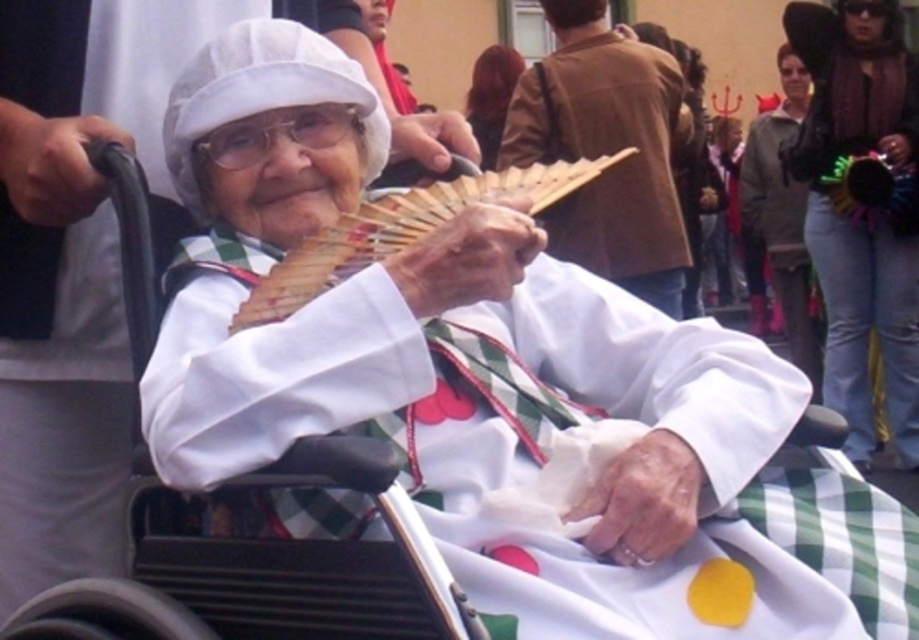
You are a photographer at the event and want to capture a photo of the elderly woman. You notice the wooden fan at center and the matte brown leather jacket at upper center. Which object should you focus on to ensure the elderly woman is in the foreground of the photo?

The wooden fan at center is below the matte brown leather jacket at upper center, so focusing on the wooden fan at center will place the elderly woman in the foreground.